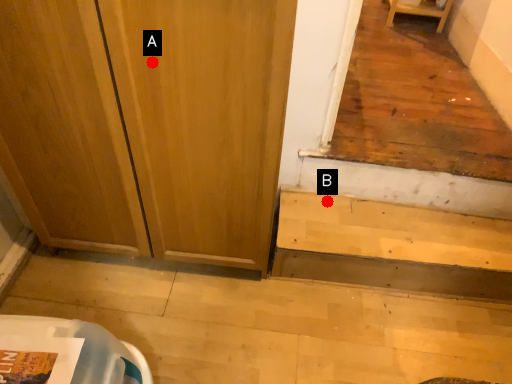
Question: Two points are circled on the image, labeled by A and B beside each circle. Among these points, which one is farthest from the camera?

Choices:
 (A) A is further
 (B) B is further

Answer: (B)